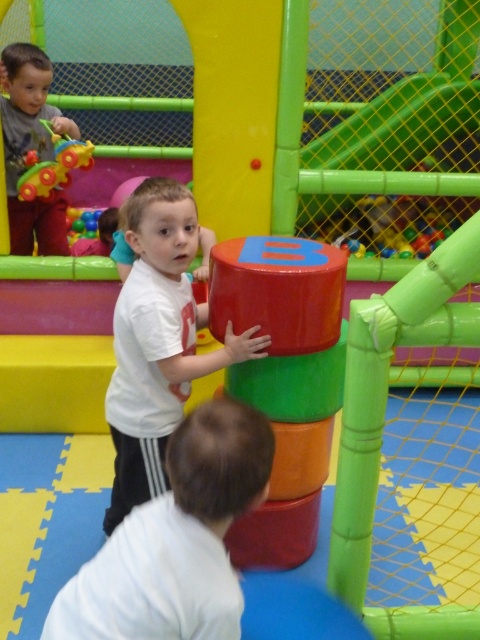
The width and height of the screenshot is (480, 640). Describe the element at coordinates (176, 540) in the screenshot. I see `white matte shirt at lower center` at that location.

Which is in front, point (228, 444) or point (259, 349)?

Point (228, 444) is more forward.

The width and height of the screenshot is (480, 640). What are the coordinates of `white matte shirt at lower center` in the screenshot? It's located at (176, 540).

Is point (233, 358) behind point (70, 157)?

No, (233, 358) is in front of (70, 157).

Between matte white shirt at center and rubberized plastic toy at upper left, which one appears on the left side from the viewer's perspective?

rubberized plastic toy at upper left is more to the left.

Locate an element on the screen. This screenshot has width=480, height=640. matte white shirt at center is located at coordinates (157, 342).

Locate an element on the screen. matte white shirt at center is located at coordinates [157, 342].

Is white matte shirt at lower center further to camera compared to rubberized plastic toy at upper left?

No.

Can you confirm if white matte shirt at lower center is positioned below rubberized plastic toy at upper left?

Correct, white matte shirt at lower center is located below rubberized plastic toy at upper left.

The width and height of the screenshot is (480, 640). Identify the location of white matte shirt at lower center. (176, 540).

You are a GUI agent. You are given a task and a screenshot of the screen. Output one action in this format:
    pyautogui.click(x=<x>, y=<y>)
    Task: Click on the white matte shirt at lower center
    This screenshot has width=480, height=640.
    Given the screenshot: What is the action you would take?
    pyautogui.click(x=176, y=540)